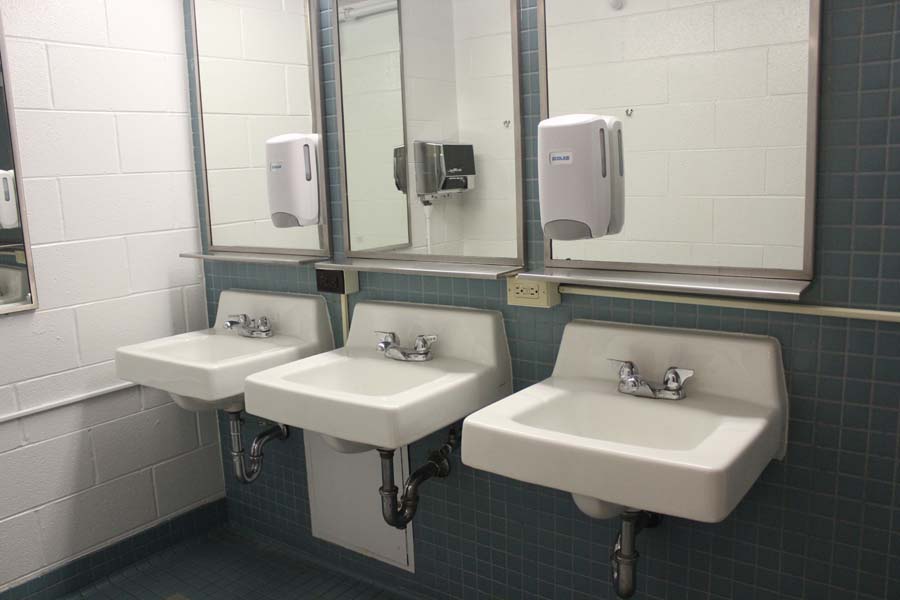
At what (x,y) coordinates should I click in order to perform the action: click on reflection of object on wall, perhaps air dryer or towel dispenser. Please return your answer as a coordinate pair (x, y). Image resolution: width=900 pixels, height=600 pixels. Looking at the image, I should click on (450, 161).